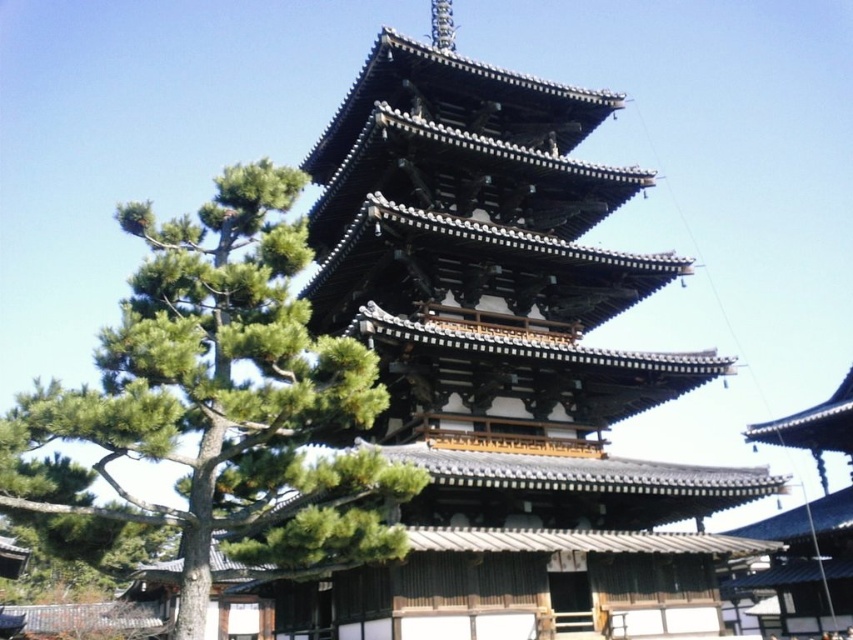
Who is taller, shiny dark brown wooden pagoda at center or green leafy tree at left?

Standing taller between the two is shiny dark brown wooden pagoda at center.

Find the location of a particular element. The width and height of the screenshot is (853, 640). shiny dark brown wooden pagoda at center is located at coordinates (503, 368).

The image size is (853, 640). Identify the location of shiny dark brown wooden pagoda at center. (503, 368).